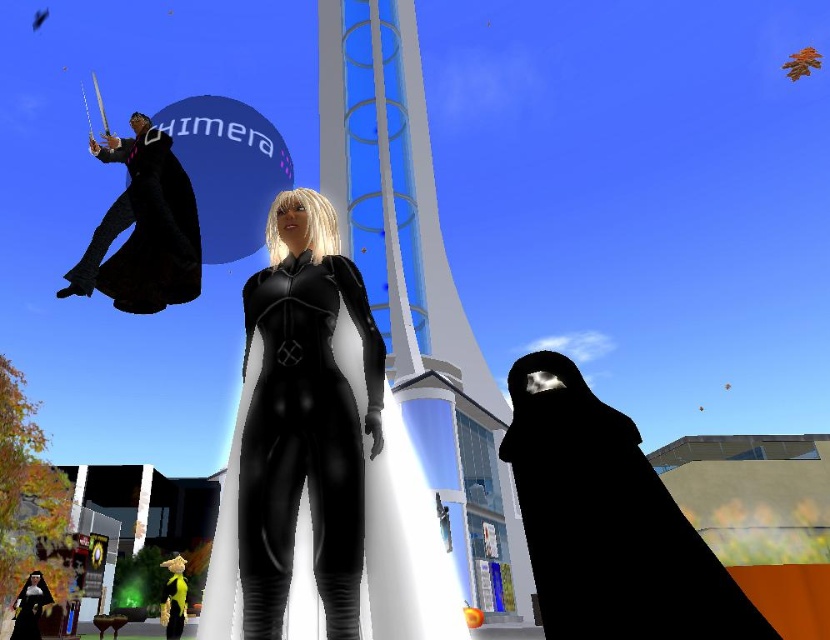
In the scene shown: Is matte black bodysuit at center positioned before matte black robe at upper left?

That is True.

Who is more distant from viewer, (276,368) or (155,273)?

Positioned behind is point (155,273).

Between point (276, 385) and point (111, 161), which one is positioned in front?

Point (276, 385) is more forward.

Find the location of a particular element. This screenshot has width=830, height=640. matte black bodysuit at center is located at coordinates (304, 420).